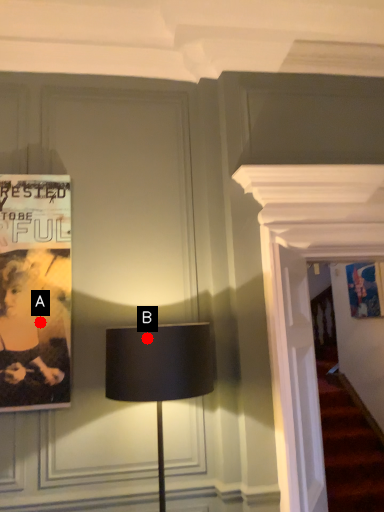
Question: Two points are circled on the image, labeled by A and B beside each circle. Which point is farther to the camera?

Choices:
 (A) A is further
 (B) B is further

Answer: (A)